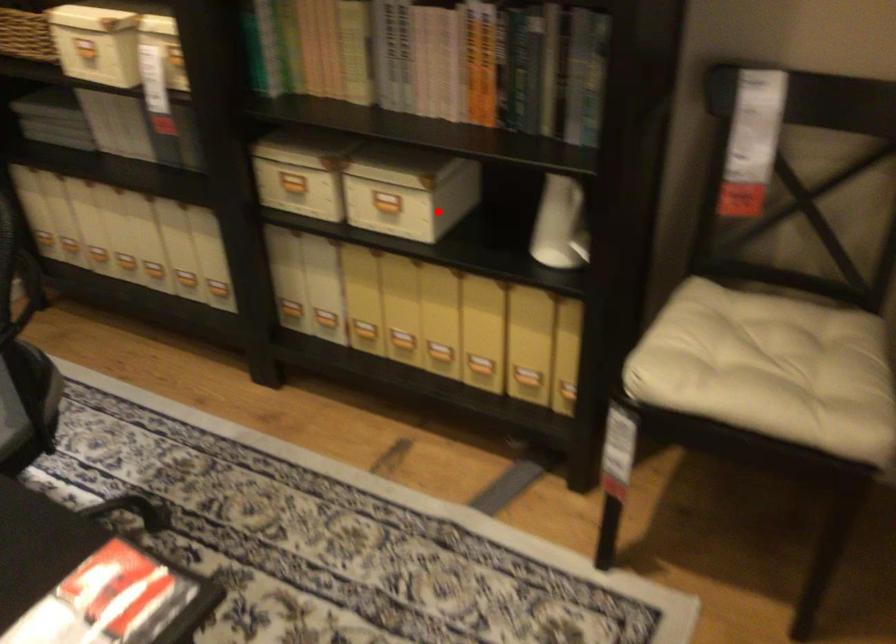
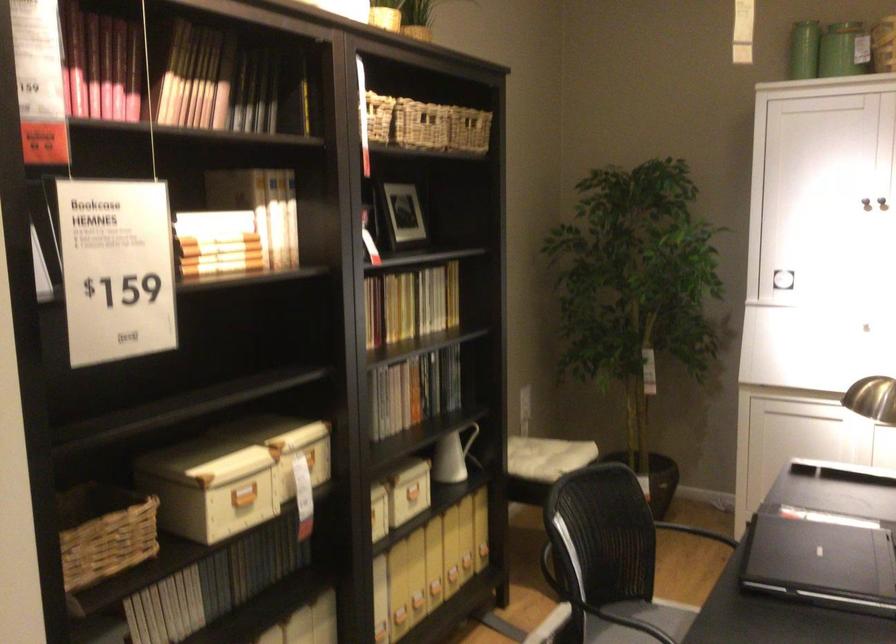
In the second image, find the point that corresponds to the highlighted location in the first image.

(418, 491)